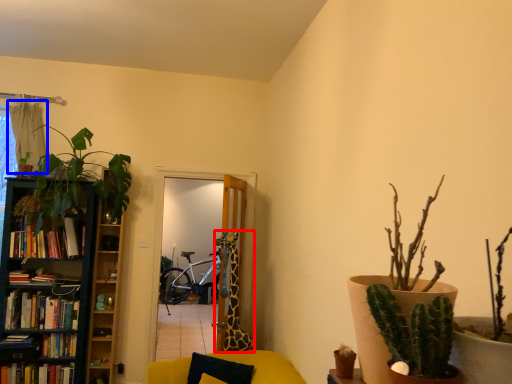
Question: Among these objects, which one is farthest to the camera, giraffe (highlighted by a red box) or curtain (highlighted by a blue box)?

Choices:
 (A) giraffe
 (B) curtain

Answer: (B)